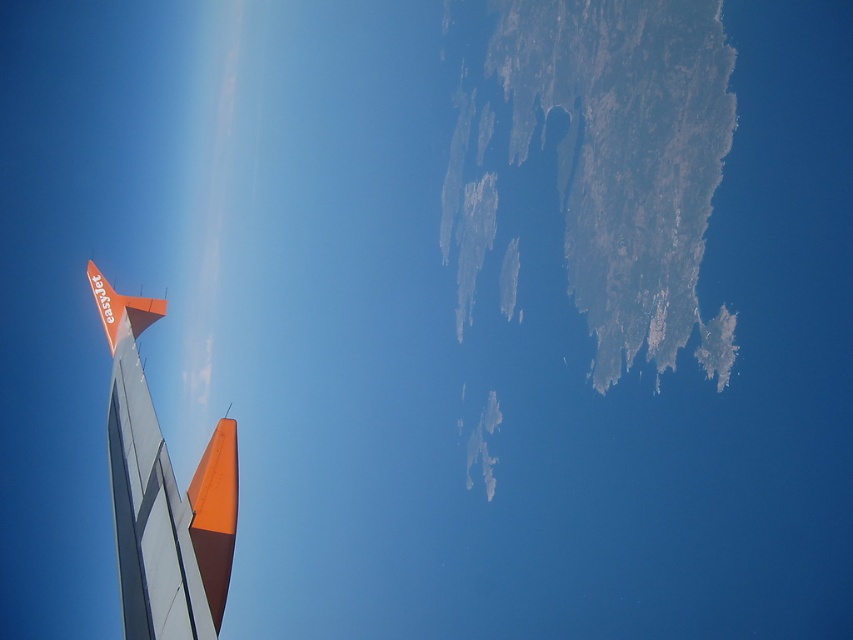
Question: Among these points, which one is nearest to the camera?

Choices:
 (A) [x=192, y=529]
 (B) [x=196, y=502]
 (C) [x=125, y=296]

Answer: (A)

Question: Which object appears closest to the camera in this image?

Choices:
 (A) orange matte tail at lower left
 (B) orange matte airplane tail at upper left
 (C) orange matte airplane wing at left

Answer: (C)

Question: Can you confirm if orange matte airplane wing at left is thinner than orange matte tail at lower left?

Choices:
 (A) yes
 (B) no

Answer: (B)

Question: Which point is farther to the camera?

Choices:
 (A) (202, 499)
 (B) (186, 545)
 (C) (132, 321)

Answer: (C)

Question: Does orange matte airplane wing at left lie behind orange matte tail at lower left?

Choices:
 (A) yes
 (B) no

Answer: (B)

Question: In this image, where is orange matte tail at lower left located relative to orange matte airplane tail at upper left?

Choices:
 (A) above
 (B) below

Answer: (B)